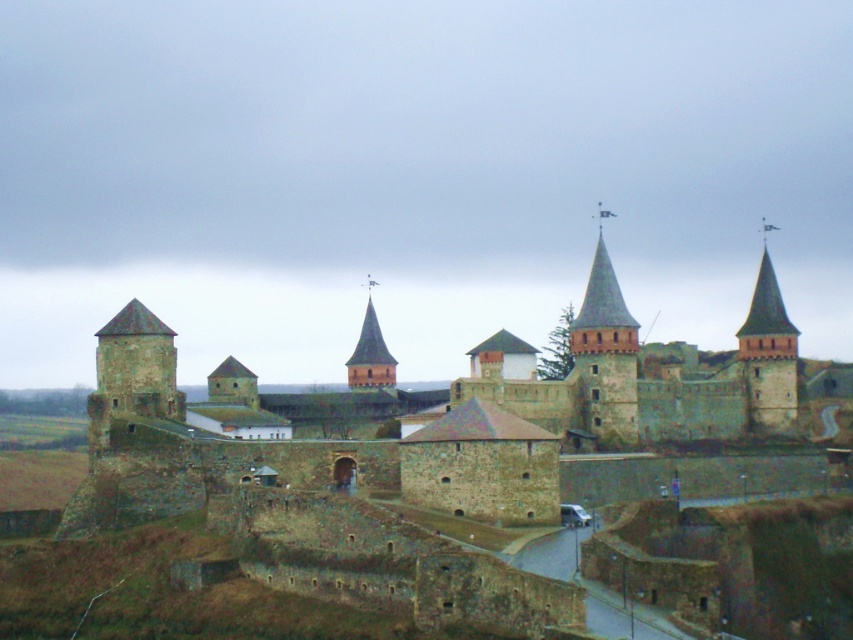
Who is positioned more to the left, rustic stone castle at center or smooth stone spire at upper right?

Positioned to the left is rustic stone castle at center.

Where is `rustic stone castle at center`? The image size is (853, 640). rustic stone castle at center is located at coordinates (405, 417).

Between rustic stone castle at center and brick stonework tower at center, which one has more height?

rustic stone castle at center

Does rustic stone castle at center appear under brick stonework tower at center?

Indeed, rustic stone castle at center is positioned under brick stonework tower at center.

Does point (764, 330) come farther from viewer compared to point (367, 276)?

No.

Where is `rustic stone castle at center`? The image size is (853, 640). rustic stone castle at center is located at coordinates (405, 417).

Based on the photo, is smooth stone spire at upper right thinner than brick stonework tower at center?

No.

Is smooth stone spire at upper right above brick stonework tower at center?

Yes.

You are a GUI agent. You are given a task and a screenshot of the screen. Output one action in this format:
    pyautogui.click(x=<x>, y=<y>)
    Task: Click on the smooth stone spire at upper right
    The height and width of the screenshot is (640, 853).
    Given the screenshot: What is the action you would take?
    pyautogui.click(x=602, y=307)